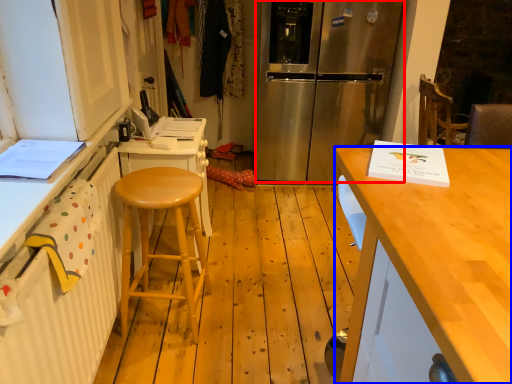
Question: Which of the following is the farthest to the observer, refrigerator (highlighted by a red box) or desk (highlighted by a blue box)?

Choices:
 (A) refrigerator
 (B) desk

Answer: (A)